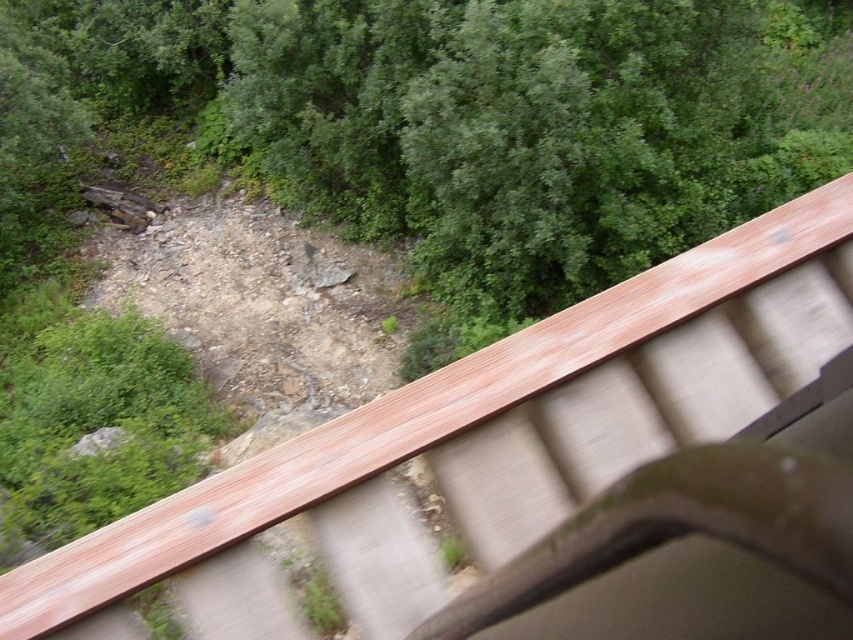
You are a hiker carrying a 40 feet long rope. You need to secure your gear between the green leafy tree at upper center and the wooden rail at upper right. Is the rope long enough to stretch between them?

The distance between the green leafy tree at upper center and the wooden rail at upper right is 39.54 feet. Since the rope is 40 feet long, it is long enough to stretch between them.

You are standing on the wooden structure and looking down at the green leafy tree at upper center and the wooden rail at upper right. Which object is higher from the ground?

The green leafy tree at upper center is taller than the wooden rail at upper right, so the green leafy tree at upper center is higher from the ground.